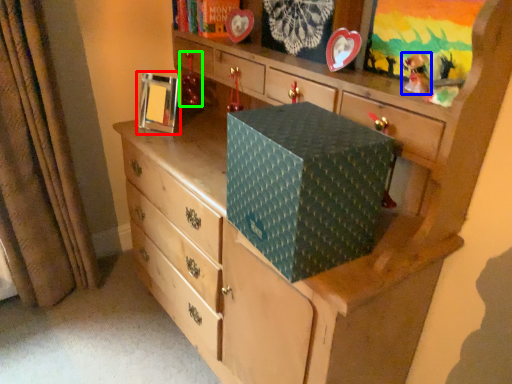
Question: Based on their relative distances, which object is farther from picture frame (highlighted by a red box)? Choose from toy (highlighted by a blue box) and toy (highlighted by a green box).

Choices:
 (A) toy
 (B) toy

Answer: (A)